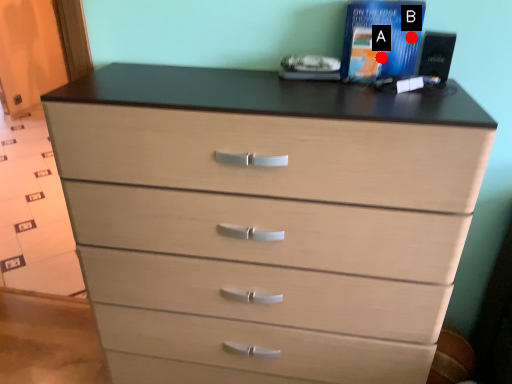
Question: Two points are circled on the image, labeled by A and B beside each circle. Which point is further to the camera?

Choices:
 (A) A is further
 (B) B is further

Answer: (A)